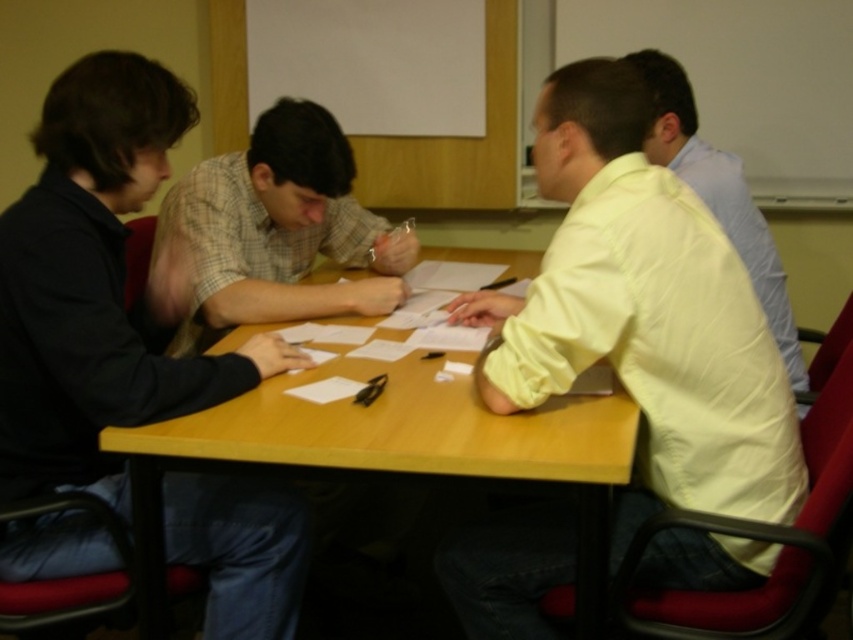
Question: Which is farther from the wooden table at center?

Choices:
 (A) light yellow shirt at upper right
 (B) checkered fabric shirt at center
 (C) black matte shirt at left

Answer: (B)

Question: Does black matte shirt at left have a lesser width compared to wooden table at center?

Choices:
 (A) no
 (B) yes

Answer: (B)

Question: Estimate the real-world distances between objects in this image. Which object is farther from the black matte shirt at left?

Choices:
 (A) wooden table at center
 (B) yellow satin shirt at right
 (C) light yellow shirt at upper right
 (D) checkered fabric shirt at center

Answer: (B)

Question: Does light yellow shirt at upper right come in front of checkered fabric shirt at center?

Choices:
 (A) yes
 (B) no

Answer: (A)

Question: Which object is farther from the camera taking this photo?

Choices:
 (A) black matte shirt at left
 (B) yellow satin shirt at right
 (C) checkered fabric shirt at center
 (D) light yellow shirt at upper right

Answer: (C)

Question: Does light yellow shirt at upper right lie in front of checkered fabric shirt at center?

Choices:
 (A) no
 (B) yes

Answer: (B)